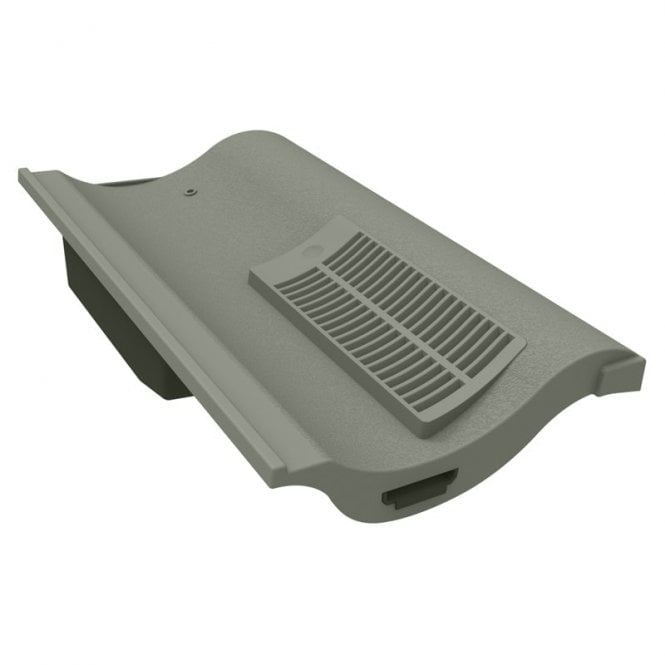
You are a GUI agent. You are given a task and a screenshot of the screen. Output one action in this format:
    pyautogui.click(x=<x>, y=<y>)
    Task: Click on the left side of vent
    Image resolution: width=665 pixels, height=665 pixels.
    Given the screenshot: What is the action you would take?
    pyautogui.click(x=422, y=320)